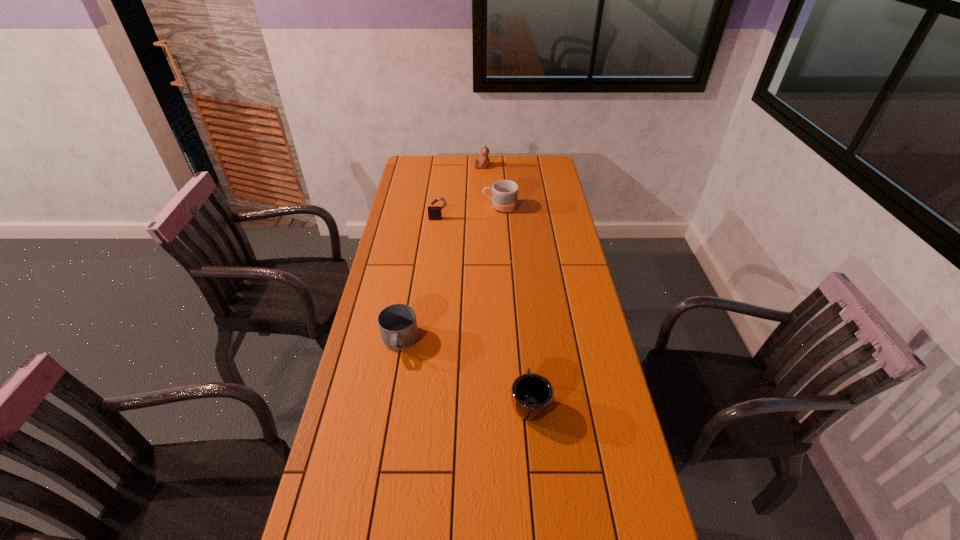
You are a GUI agent. You are given a task and a screenshot of the screen. Output one action in this format:
    pyautogui.click(x=<x>, y=<y>)
    Task: Click on the free area in between the farthest mug and the farthest object
    The width and height of the screenshot is (960, 540).
    Given the screenshot: What is the action you would take?
    pyautogui.click(x=491, y=187)

The image size is (960, 540). Identify the location of vacant area that lies between the farthest mug and the teddy bear. (491, 187).

Choose which object is the third nearest neighbor to the farthest mug. Please provide its 2D coordinates. Your answer should be formatted as a tuple, i.e. [(x, y)], where the tuple contains the x and y coordinates of a point satisfying the conditions above.

[(398, 326)]

Identify which object is the closest to the third farthest object. Please provide its 2D coordinates. Your answer should be formatted as a tuple, i.e. [(x, y)], where the tuple contains the x and y coordinates of a point satisfying the conditions above.

[(505, 192)]

Locate an element on the screen. mug identified as the second closest to the leftmost mug is located at coordinates (505, 192).

The image size is (960, 540). Identify the location of mug that stands as the second closest to the farthest object. (398, 326).

The image size is (960, 540). In order to click on vacant space that satisfies the following two spatial constraints: 1. on the side with the handle of the fourth nearest object; 2. on the side of the nearest object with the handle in this screenshot , I will do `click(512, 402)`.

You are a GUI agent. You are given a task and a screenshot of the screen. Output one action in this format:
    pyautogui.click(x=<x>, y=<y>)
    Task: Click on the vacant space that satisfies the following two spatial constraints: 1. on the face of the farthest object; 2. with the keyhole on the front of the padlock
    
    Given the screenshot: What is the action you would take?
    pyautogui.click(x=482, y=219)

Locate an element on the screen. vacant space that satisfies the following two spatial constraints: 1. on the face of the teddy bear; 2. with the keyhole on the front of the padlock is located at coordinates (482, 219).